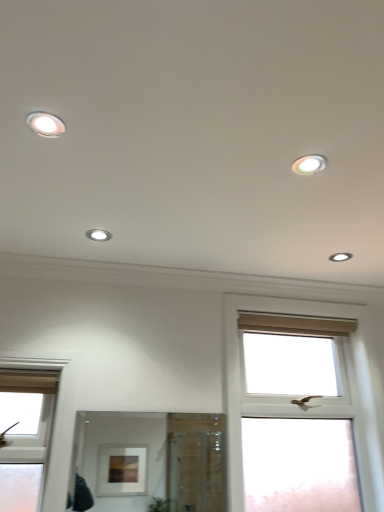
Question: Is point (221, 492) positioned closer to the camera than point (319, 169)?

Choices:
 (A) farther
 (B) closer

Answer: (A)

Question: From their relative heights in the image, would you say clear glass mirror at center is taller or shorter than white glossy light fixture at upper right, the third dot when ordered from back to front?

Choices:
 (A) tall
 (B) short

Answer: (A)

Question: Which of these objects is positioned farthest from the white glossy light fixture at center, which appears as the second dot when ordered from the bottom?

Choices:
 (A) white glossy light fixture at upper right, positioned as the third dot in left-to-right order
 (B) white glossy light fixture at upper right, which appears as the second dot when viewed from the left
 (C) white plastic window at center right, acting as the second window starting from the left
 (D) clear glass mirror at center
 (E) matte white window at left, the first window positioned from the left

Answer: (D)

Question: Based on their relative distances, which object is nearer to the matte white window at left, the first window positioned from the left?

Choices:
 (A) clear glass mirror at center
 (B) white glossy light fixture at upper right, which appears as the 1th dot when viewed from the right
 (C) white plastic window at center right, the first window in the right-to-left sequence
 (D) white glossy light fixture at upper right, which appears as the second dot when viewed from the left
 (E) white glossy light fixture at center, the 2th dot when ordered from front to back

Answer: (E)